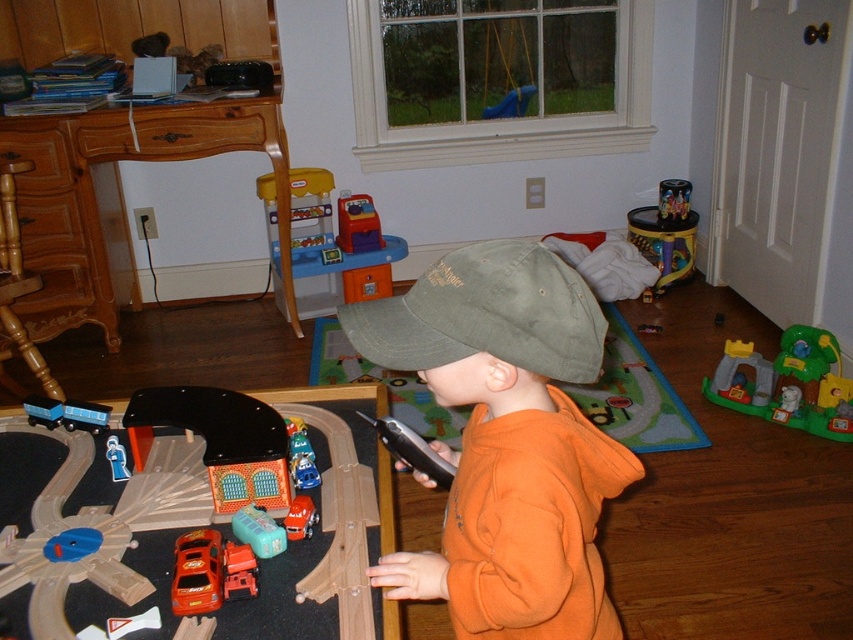
You are standing in the playroom and want to place a new toy car exactly where the olive green fabric baseball cap at center is currently located. Is this possible without moving the cap?

The olive green fabric baseball cap at center is located at point (486,314), so yes, you can place the new toy car there without moving the cap as long as there is space.

You are a parent trying to organize the toy cars on the train tracks. You need to place a new car between the rubberized plastic toy car at center and the smooth plastic car at center. Where should you position the new car?

The rubberized plastic toy car at center is located above the smooth plastic car at center, so you should place the new car between them either above or below depending on the desired arrangement. However, since the existing cars are vertically positioned, placing the new car between them would require positioning it in the space between the two along the vertical axis.

You are a parent trying to retrieve a toy car for your child. You see the rubberized plastic toy car at center and the smooth plastic car at center. Which one is closer to you?

The rubberized plastic toy car at center is closer to you because it is further to the viewer than the smooth plastic car at center.